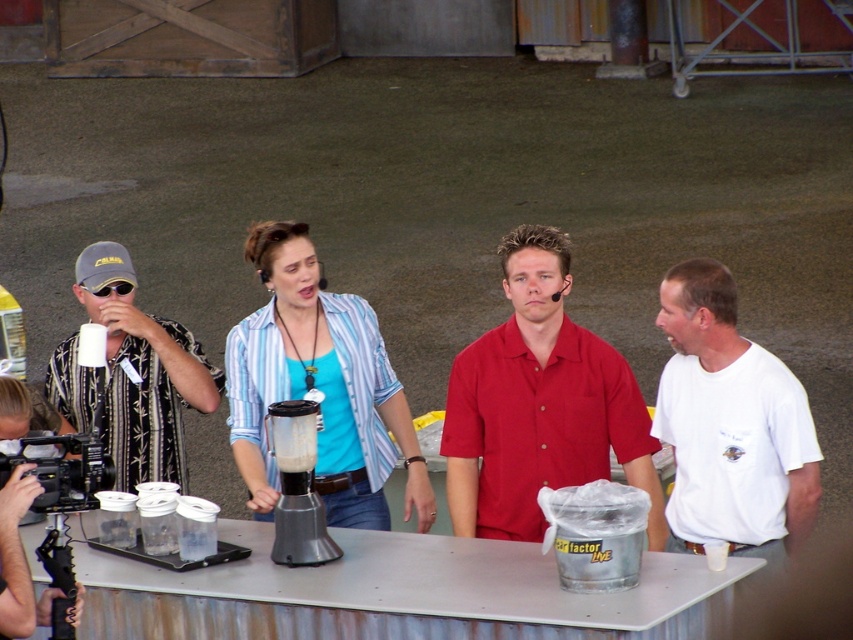
You are a photographer at the event and need to adjust the lighting so that both the red matte shirt at center and the printed fabric shirt at left are well illuminated. Which shirt should you focus the light on first to ensure both are properly lit, considering their positions?

The red matte shirt at center is located below the printed fabric shirt at left. Since it is lower, focusing the light on the red matte shirt at center first will help ensure both are illuminated adequately without shadows from the higher shirt blocking the light.

Based on the scene description, where is the translucent plastic blender at center located in terms of coordinates?

The translucent plastic blender at center is located at coordinates point (297, 486).

You are a participant in the event and want to place a cup on the metallic gray table at center without knocking over the translucent plastic blender at center. Based on their positions, which object should you approach first?

The metallic gray table at center is in front of the translucent plastic blender at center, so you should approach the metallic gray table at center first to place the cup without disturbing the blender.